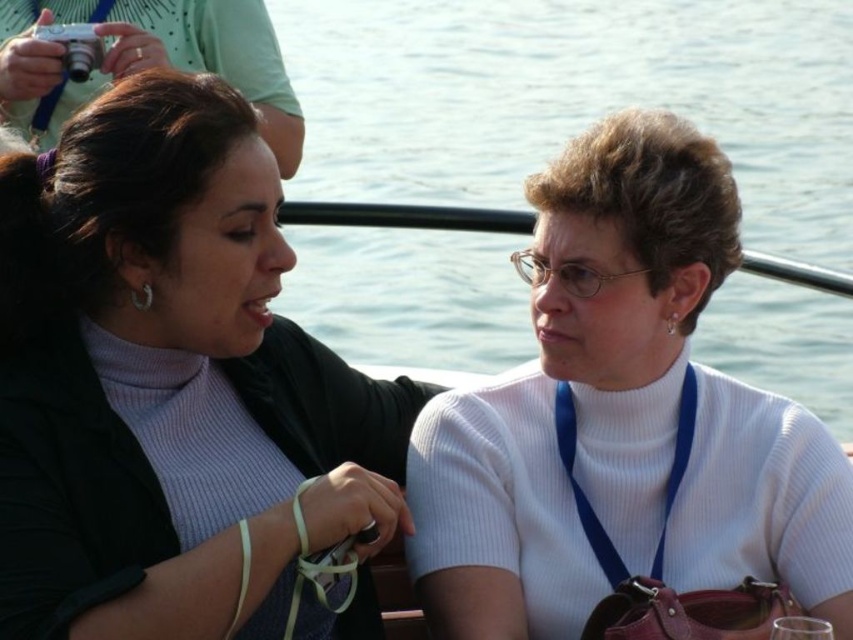
You are standing in a room with the two women described. You need to place a small plant between the matte black jacket at left and the clear blue water at center. Where should you place it?

The matte black jacket at left is to the left of clear blue water at center, so place the plant between them, ensuring it is positioned to the right of the matte black jacket at left and to the left of the clear blue water at center.

You are standing in front of a group photo and notice the matte black jacket at left and the white ribbed sweater at center. Which clothing item is positioned closer to you?

The matte black jacket at left is closer to the viewer than the white ribbed sweater at center.